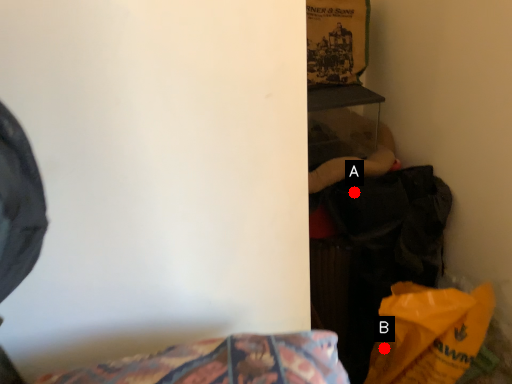
Question: Two points are circled on the image, labeled by A and B beside each circle. Which of the following is the closest to the observer?

Choices:
 (A) A is closer
 (B) B is closer

Answer: (B)